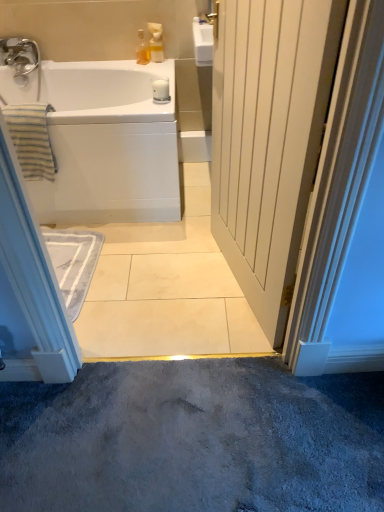
Question: From the image's perspective, relative to striped cotton towel at left, is white glossy bathtub at upper left above or below?

Choices:
 (A) below
 (B) above

Answer: (B)

Question: Is point (100, 78) closer or farther from the camera than point (21, 125)?

Choices:
 (A) farther
 (B) closer

Answer: (A)

Question: Based on their relative distances, which object is farther from the striped cotton towel at left?

Choices:
 (A) translucent glass bottle at upper center, marked as the second toiletry in a right-to-left arrangement
 (B) white glossy soap dispenser at upper center, marked as the 2th toiletry in a left-to-right arrangement
 (C) white glossy bathtub at upper left
 (D) white wood door at center

Answer: (D)

Question: Estimate the real-world distances between objects in this image. Which object is closer to the striped cotton towel at left?

Choices:
 (A) white glossy soap dispenser at upper center, which is the first toiletry in right-to-left order
 (B) white wood door at center
 (C) white glossy bathtub at upper left
 (D) translucent glass bottle at upper center, placed as the first toiletry when sorted from left to right

Answer: (C)